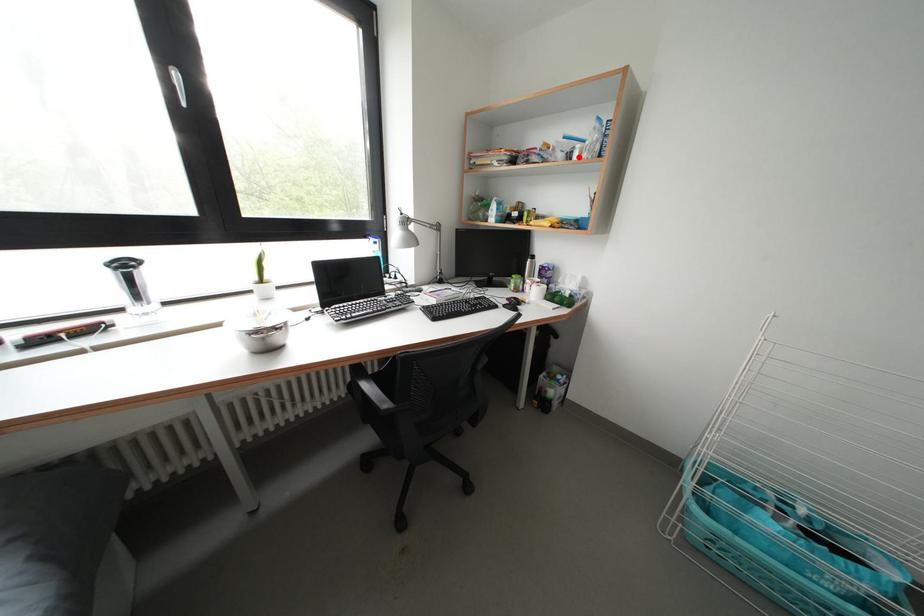
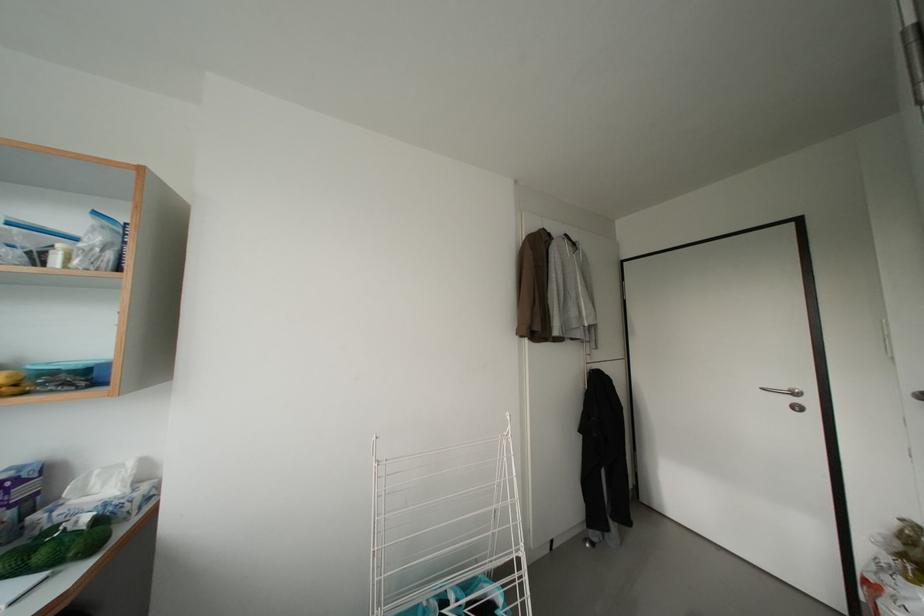
Find the pixel in the second image that matches the highlighted location in the first image.

(51, 257)